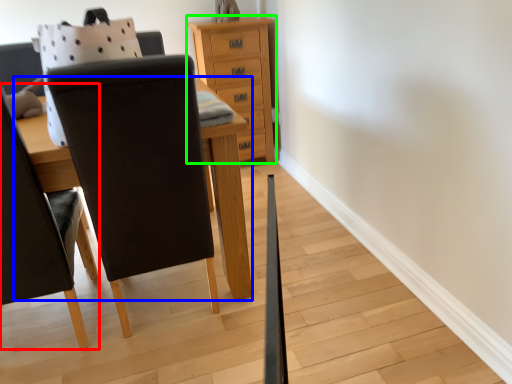
Question: Based on their relative distances, which object is nearer to chair (highlighted by a red box)? Choose from table (highlighted by a blue box) and chest of drawers (highlighted by a green box).

Choices:
 (A) table
 (B) chest of drawers

Answer: (A)